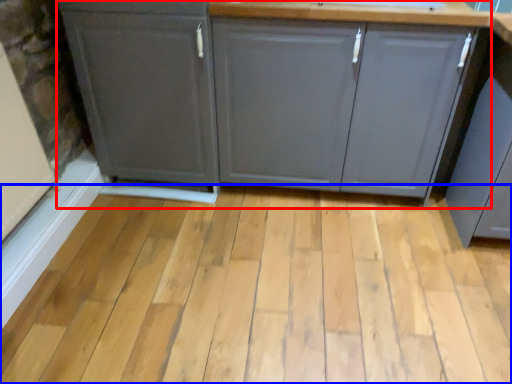
Question: Which of the following is the farthest to the observer, cabinetry (highlighted by a red box) or plank (highlighted by a blue box)?

Choices:
 (A) cabinetry
 (B) plank

Answer: (A)